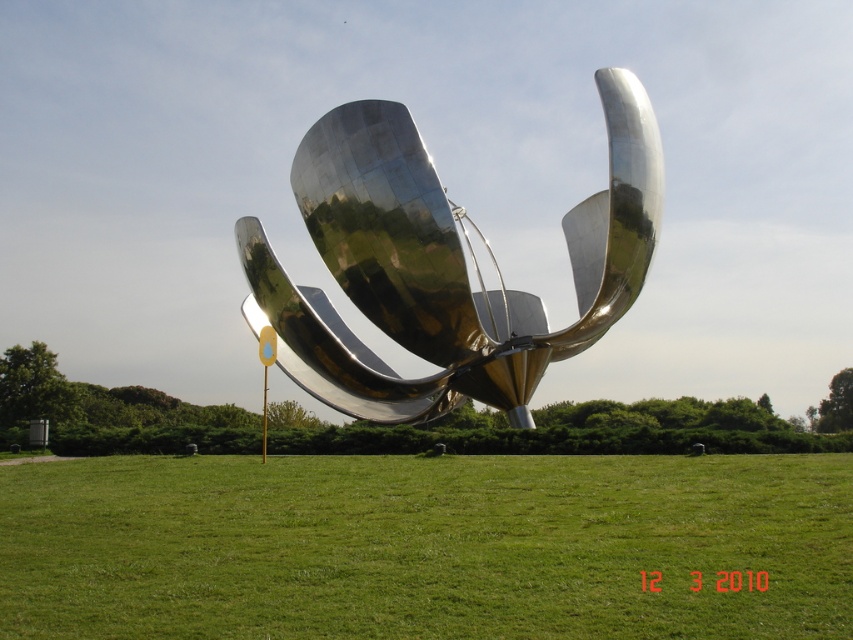
Who is taller, green grass at center or shiny metallic flower at center?

shiny metallic flower at center is taller.

Can you confirm if green grass at center is taller than shiny metallic flower at center?

No, green grass at center is not taller than shiny metallic flower at center.

Who is more forward, (318, 556) or (334, 252)?

Positioned in front is point (318, 556).

This screenshot has height=640, width=853. Identify the location of green grass at center. (426, 547).